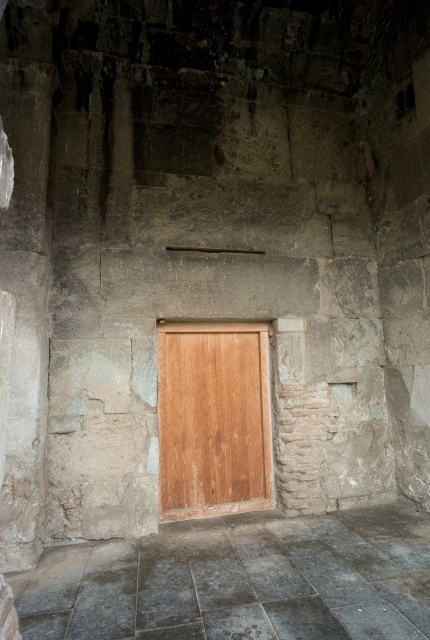
Question: Is smooth stone floor at center wider than wooden door at center?

Choices:
 (A) yes
 (B) no

Answer: (A)

Question: Is smooth stone floor at center closer to the viewer compared to wooden door at center?

Choices:
 (A) no
 (B) yes

Answer: (B)

Question: Is the position of smooth stone floor at center less distant than that of wooden door at center?

Choices:
 (A) no
 (B) yes

Answer: (B)

Question: Which point is farther to the camera?

Choices:
 (A) (224, 512)
 (B) (208, 621)

Answer: (A)